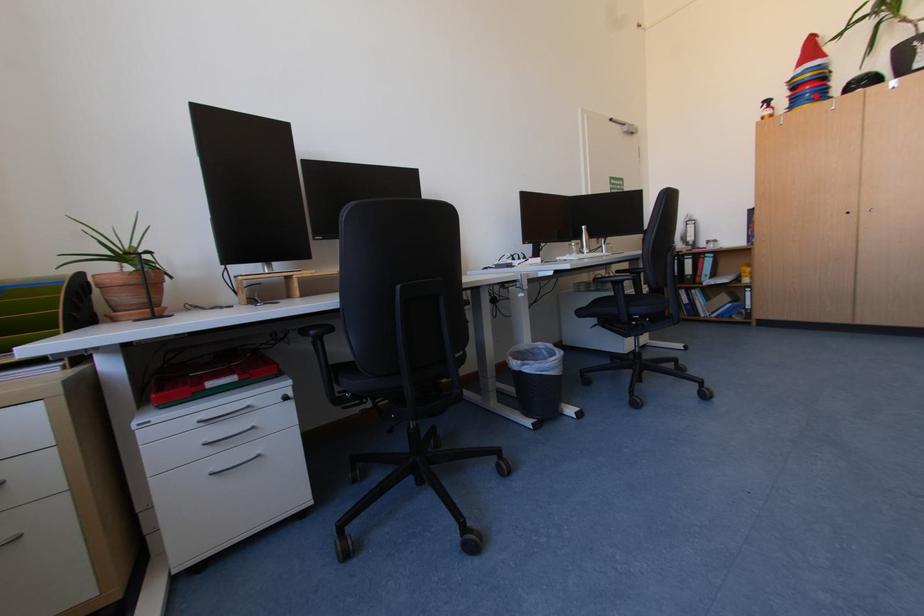
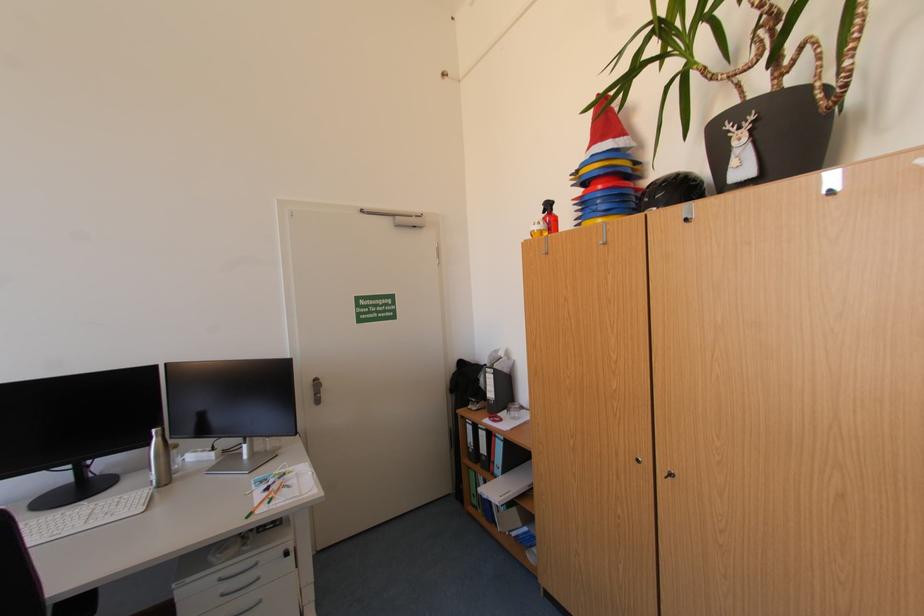
Question: I am providing you with two images of the same scene from different viewpoints. Image1 has a red point marked. In image2, the corresponding 3D location appears at what relative position? Reply with the corresponding letter.

Choices:
 (A) Closer
 (B) Farther

Answer: (A)